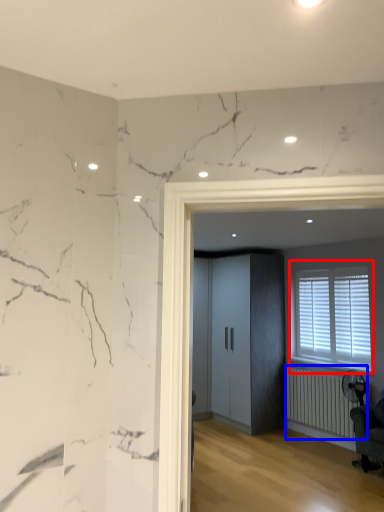
Question: Which point is further to the camera, window (highlighted by a red box) or radiator (highlighted by a blue box)?

Choices:
 (A) window
 (B) radiator

Answer: (A)